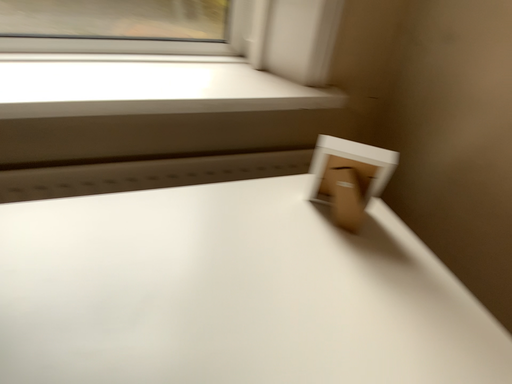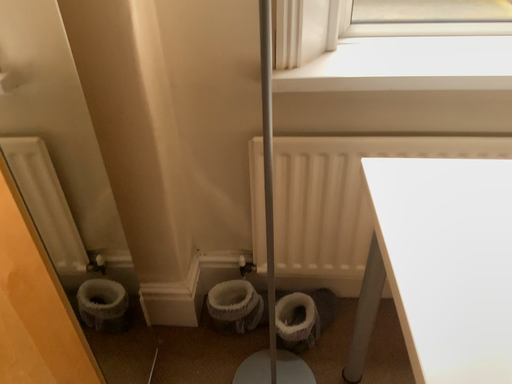
Question: Which way did the camera rotate in the video?

Choices:
 (A) rotated left
 (B) rotated right

Answer: (A)